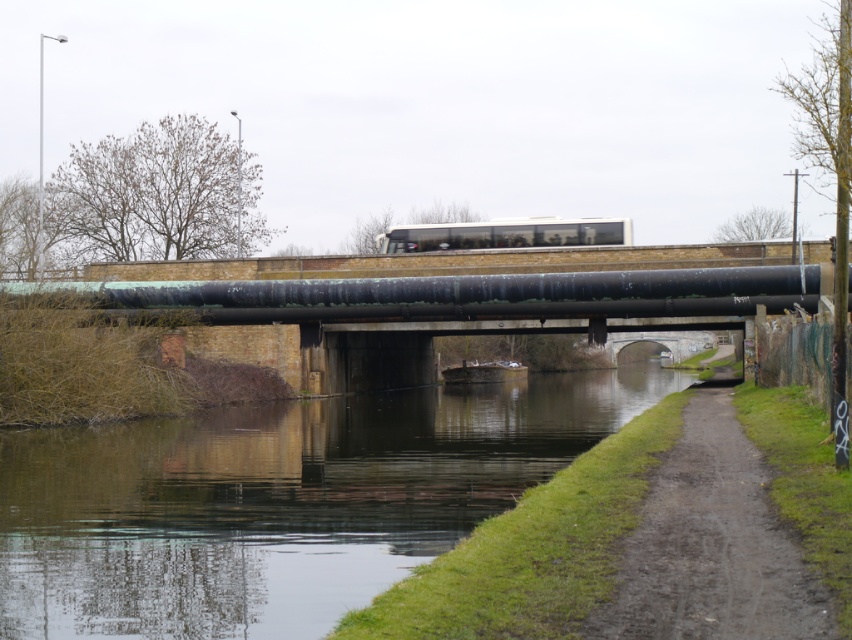
Question: Can you confirm if green grassy river at lower left is thinner than greenish-brown concrete bridge at center?

Choices:
 (A) yes
 (B) no

Answer: (A)

Question: Which of the following is the farthest from the observer?

Choices:
 (A) (488, 275)
 (B) (674, 621)
 (C) (378, 250)
 (D) (168, 288)

Answer: (C)

Question: Which of the following is the closest to the observer?

Choices:
 (A) (492, 308)
 (B) (6, 612)
 (C) (608, 220)

Answer: (B)

Question: Can you confirm if green grassy river at lower left is wider than dirt/gravel path at lower right?

Choices:
 (A) no
 (B) yes

Answer: (B)

Question: Which of these objects is positioned farthest from the dirt/gravel path at lower right?

Choices:
 (A) green patina pipe at center
 (B) green grassy river at lower left
 (C) white glass passenger train at center

Answer: (C)

Question: Does green grassy river at lower left appear over green patina pipe at center?

Choices:
 (A) yes
 (B) no

Answer: (B)